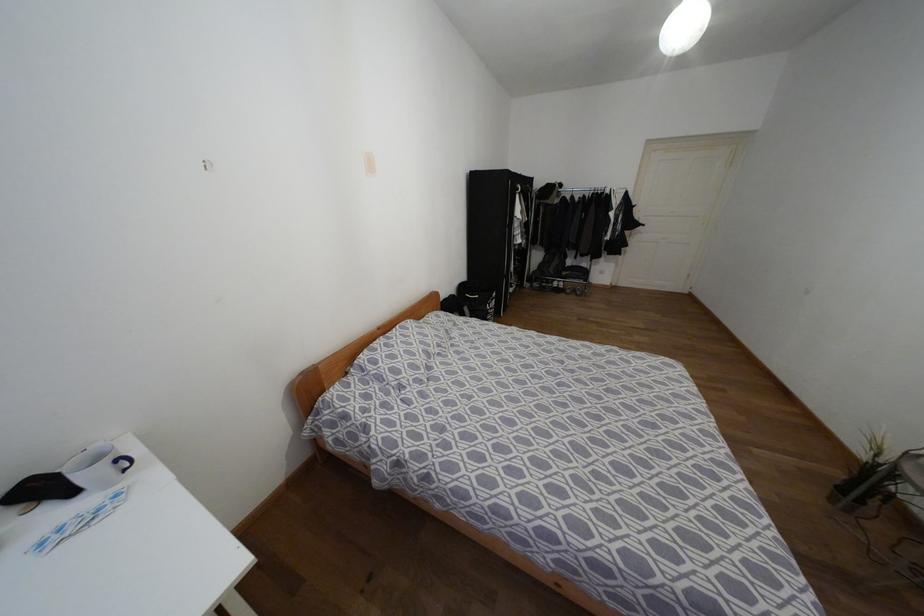
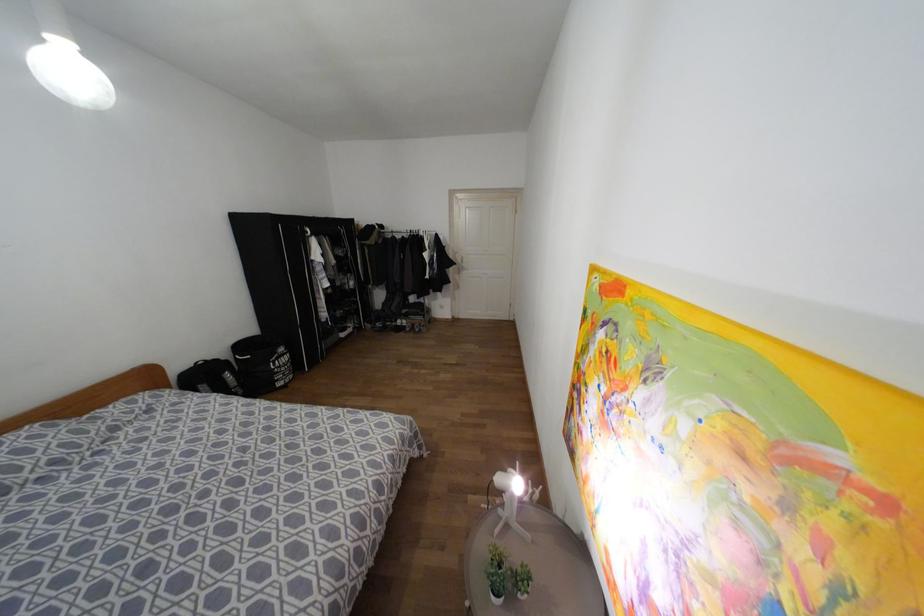
Where in the second image is the point corresponding to point 493,294 from the first image?

(281, 349)